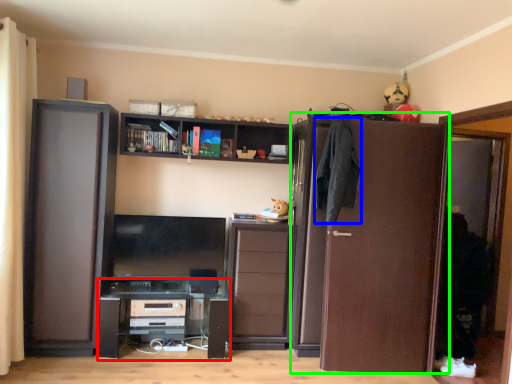
Question: Which is nearer to the computer desk (highlighted by a red box)? clothing (highlighted by a blue box) or door (highlighted by a green box).

Choices:
 (A) clothing
 (B) door

Answer: (B)